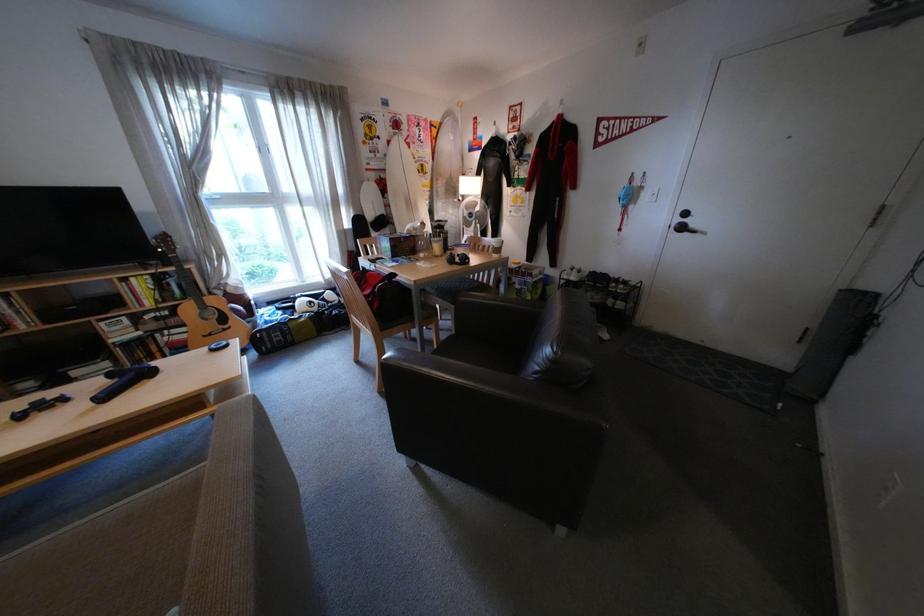
Find where to lift the black headphones. Please return your answer as a coordinate pair (x, y).

(456, 257)